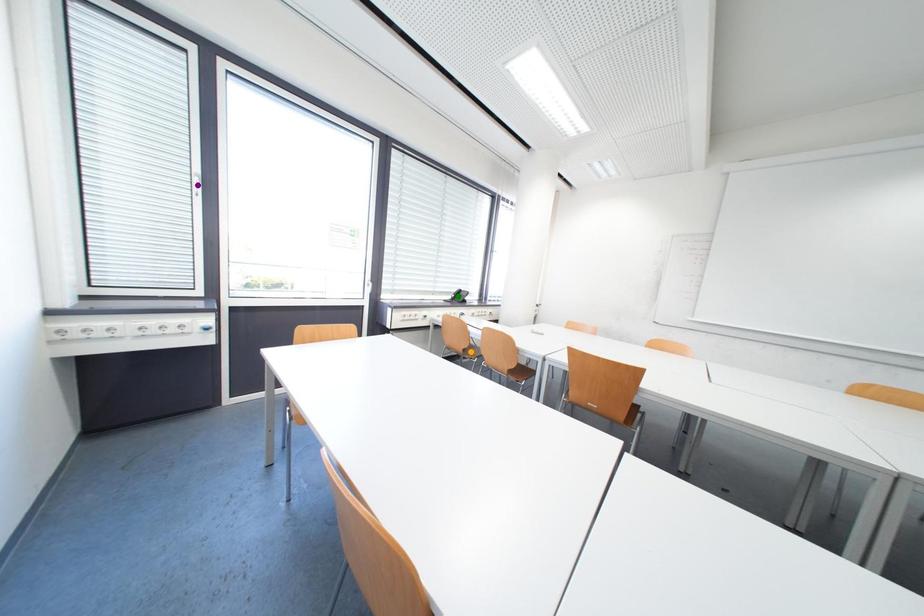
Order these from nearest to farthest:
green point
orange point
purple point

purple point
orange point
green point